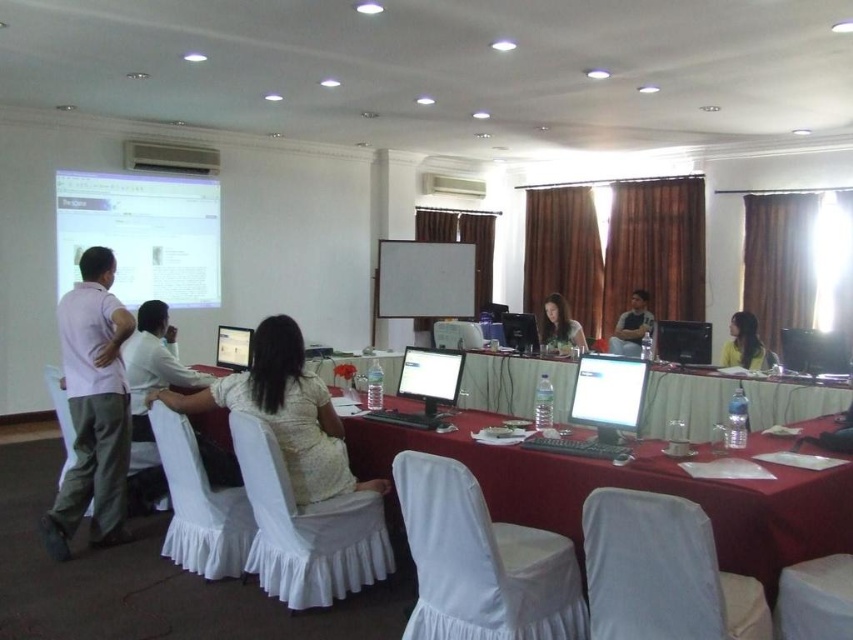
You are a photographer positioned at the back of the conference room. You want to take a photo of the white textured dress at center and light brown hair at center so that both are in focus. The camera you are using has a depth of field that can cover objects within a 3.5 meter range. Is this possible?

The white textured dress at center is 4.01 meters from light brown hair at center. Since the distance between them exceeds the camera s 3.5 meter depth of field range, it is not possible to have both in focus simultaneously.

You are standing in the conference room and want to present your slides. The projector is on the left side of the room. You need to adjust the focus of the projector to ensure the text is clear on the white glossy projection screen at upper left. Considering the screen is 7.13 meters away, is this distance within the typical focus range of most projectors?

Most projectors have a focus range that can adjust from about 1 meter to 10 meters. Since the white glossy projection screen at upper left is 7.13 meters away, this distance falls within the typical focus range of most projectors, so the projector should be able to focus clearly on the screen.

You are standing in the conference room and want to move from the point at coordinates point (x=271, y=353) to the point at coordinates point (x=755, y=320). Which direction should you move relative to the camera?

You should move backward relative to the camera because point (x=271, y=353) is in front of point (x=755, y=320).